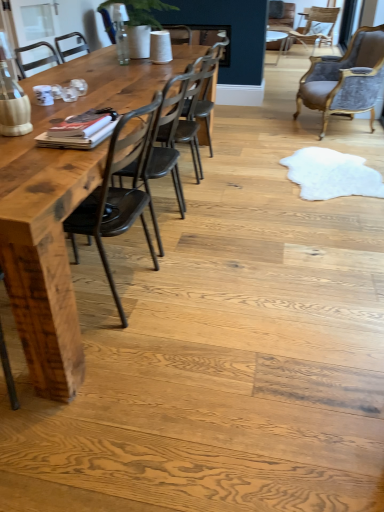
What is the approximate width of dark brown wood chair at center, which is the fourth chair from top to bottom?

dark brown wood chair at center, which is the fourth chair from top to bottom, is 22.74 inches wide.

Describe the element at coordinates (61, 210) in the screenshot. The height and width of the screenshot is (512, 384). I see `wooden table at left` at that location.

This screenshot has height=512, width=384. In order to click on velvet grey chair at upper right, which ranks as the 3th chair in left-to-right order in this screenshot , I will do `click(345, 78)`.

Locate an element on the screen. The image size is (384, 512). dark brown wood chair at center, the 4th chair from the right is located at coordinates (162, 148).

Does wooden table at left have a lesser width compared to velvet upholstered chair at upper right, the 4th chair ordered from the bottom?

No.

Can you tell me how much wooden table at left and velvet upholstered chair at upper right, which is counted as the 4th chair, starting from the front, differ in facing direction?

33 degrees.

In terms of size, does wooden table at left appear bigger or smaller than velvet upholstered chair at upper right, the 4th chair when ordered from left to right?

wooden table at left is bigger than velvet upholstered chair at upper right, the 4th chair when ordered from left to right.

Could you tell me if wooden table at left is turned towards velvet upholstered chair at upper right, the 4th chair ordered from the bottom?

No, wooden table at left is not aimed at velvet upholstered chair at upper right, the 4th chair ordered from the bottom.

Is velvet grey chair at upper right, placed as the second chair when sorted from right to left, located outside dark brown wood chair at center, placed as the first chair when sorted from bottom to top?

velvet grey chair at upper right, placed as the second chair when sorted from right to left, lies outside dark brown wood chair at center, placed as the first chair when sorted from bottom to top,'s area.

Is point (342, 106) closer or farther from the camera than point (142, 170)?

Point (342, 106) is farther from the camera than point (142, 170).

From the picture: From a real-world perspective, who is located higher, velvet grey chair at upper right, which ranks as the 3th chair in left-to-right order, or dark brown wood chair at center, the first chair when ordered from front to back?

In real-world perspective, velvet grey chair at upper right, which ranks as the 3th chair in left-to-right order, is above.

Is velvet grey chair at upper right, the third chair when ordered from front to back, in front of dark brown wood chair at center, the 4th chair from the back?

No, velvet grey chair at upper right, the third chair when ordered from front to back, is further to the viewer.

Find the location of a particular element. This screenshot has height=512, width=384. the 3rd chair behind when counting from the dark brown wood chair at center, placed as the first chair when sorted from bottom to top is located at coordinates (316, 26).

Which is in front, point (309, 41) or point (134, 168)?

The point (134, 168) is closer to the camera.

Is velvet upholstered chair at upper right, which is the 1th chair in right-to-left order, next to dark brown wood chair at center, the first chair when ordered from front to back, and touching it?

No, velvet upholstered chair at upper right, which is the 1th chair in right-to-left order, is not making contact with dark brown wood chair at center, the first chair when ordered from front to back.

Is velvet upholstered chair at upper right, which is counted as the 4th chair, starting from the front, facing away from dark brown wood chair at center, which is the fourth chair from top to bottom?

velvet upholstered chair at upper right, which is counted as the 4th chair, starting from the front, does not have its back to dark brown wood chair at center, which is the fourth chair from top to bottom.

Where is `chair below the wooden table at left (from the image's perspective)`? The height and width of the screenshot is (512, 384). chair below the wooden table at left (from the image's perspective) is located at coordinates point(162,148).

Considering the points (42, 247) and (179, 197), which point is behind, point (42, 247) or point (179, 197)?

Point (179, 197)

From a real-world perspective, does wooden table at left sit lower than dark brown wood chair at center, the 4th chair from the back?

Yes, from a real-world perspective, wooden table at left is under dark brown wood chair at center, the 4th chair from the back.

Are wooden table at left and dark brown wood chair at center, acting as the 1th chair starting from the left, far apart?

That's not correct — wooden table at left is a little close to dark brown wood chair at center, acting as the 1th chair starting from the left.

Is dark brown wood chair at center, acting as the 1th chair starting from the left, taller or shorter than velvet upholstered chair at upper right, which is counted as the 1th chair, starting from the back?

dark brown wood chair at center, acting as the 1th chair starting from the left, is taller than velvet upholstered chair at upper right, which is counted as the 1th chair, starting from the back.

Does dark brown wood chair at center, the 4th chair from the right, have a larger size compared to velvet upholstered chair at upper right, which appears as the 1th chair when viewed from the top?

Incorrect, dark brown wood chair at center, the 4th chair from the right, is not larger than velvet upholstered chair at upper right, which appears as the 1th chair when viewed from the top.

Locate an element on the screen. The height and width of the screenshot is (512, 384). the 3rd chair counting from the right of the dark brown wood chair at center, the first chair when ordered from front to back is located at coordinates (316, 26).

Which object is thinner, dark brown wood chair at center, the 4th chair from the back, or velvet upholstered chair at upper right, which is the 1th chair in right-to-left order?

Thinner between the two is dark brown wood chair at center, the 4th chair from the back.

Between dark brown wood chair at center, the first chair when ordered from front to back, and wooden table at left, which one has more height?

dark brown wood chair at center, the first chair when ordered from front to back, is taller.

Can you confirm if dark brown wood chair at center, which is the fourth chair from top to bottom, is wider than wooden table at left?

In fact, dark brown wood chair at center, which is the fourth chair from top to bottom, might be narrower than wooden table at left.

From the image's perspective, is dark brown wood chair at center, placed as the first chair when sorted from bottom to top, on wooden table at left?

Actually, dark brown wood chair at center, placed as the first chair when sorted from bottom to top, appears below wooden table at left in the image.

Is wooden table at left completely or partially inside dark brown wood chair at center, the 4th chair from the right?

No, wooden table at left is located outside of dark brown wood chair at center, the 4th chair from the right.

Looking at this image, between velvet grey chair at upper right, which ranks as the 3th chair in left-to-right order, and velvet upholstered chair at upper right, which is counted as the 1th chair, starting from the back, which one has smaller size?

velvet upholstered chair at upper right, which is counted as the 1th chair, starting from the back.

Is velvet upholstered chair at upper right, which is counted as the 4th chair, starting from the front, at the back of velvet grey chair at upper right, placed as the second chair when sorted from right to left?

No.

Which of these two, velvet grey chair at upper right, the 2th chair in the top-to-bottom sequence, or velvet upholstered chair at upper right, which appears as the 1th chair when viewed from the top, stands taller?

velvet grey chair at upper right, the 2th chair in the top-to-bottom sequence.

You are a GUI agent. You are given a task and a screenshot of the screen. Output one action in this format:
    pyautogui.click(x=<x>, y=<y>)
    Task: Click on the 3rd chair above when counting from the wooden table at left (from the image's perspective)
    Image resolution: width=384 pixels, height=512 pixels.
    Given the screenshot: What is the action you would take?
    pyautogui.click(x=316, y=26)

At what (x,y) coordinates should I click in order to perform the action: click on chair that is the 2nd object to the left of the velvet grey chair at upper right, which ranks as the 3th chair in left-to-right order, starting at the anchor. Please return your answer as a coordinate pair (x, y). The width and height of the screenshot is (384, 512). Looking at the image, I should click on [162, 148].

When comparing their distances from metallic dark brown chair at center, the second chair viewed from the left, does dark brown wood chair at center, which is the fourth chair from top to bottom, or velvet grey chair at upper right, the third chair when ordered from front to back, seem further?

The object further to metallic dark brown chair at center, the second chair viewed from the left, is velvet grey chair at upper right, the third chair when ordered from front to back.

Based on their spatial positions, is metallic dark brown chair at center, which is the 2th chair from front to back, or dark brown wood chair at center, placed as the first chair when sorted from bottom to top, closer to wooden table at left?

dark brown wood chair at center, placed as the first chair when sorted from bottom to top, is positioned closer to the anchor wooden table at left.

Considering their positions, is metallic dark brown chair at center, placed as the third chair when sorted from right to left, positioned further to wooden table at left than velvet upholstered chair at upper right, the 4th chair ordered from the bottom?

velvet upholstered chair at upper right, the 4th chair ordered from the bottom.

Considering their positions, is dark brown wood chair at center, the first chair when ordered from front to back, positioned closer to wooden table at left than metallic dark brown chair at center, the third chair in the top-to-bottom sequence?

Among the two, dark brown wood chair at center, the first chair when ordered from front to back, is located nearer to wooden table at left.

Estimate the real-world distances between objects in this image. Which object is further from velvet grey chair at upper right, which ranks as the 3th chair in left-to-right order, velvet upholstered chair at upper right, which appears as the 1th chair when viewed from the top, or wooden table at left?

velvet upholstered chair at upper right, which appears as the 1th chair when viewed from the top.

Based on their spatial positions, is wooden table at left or velvet upholstered chair at upper right, the 4th chair when ordered from left to right, further from metallic dark brown chair at center, which is the third chair in back-to-front order?

Among the two, velvet upholstered chair at upper right, the 4th chair when ordered from left to right, is located further to metallic dark brown chair at center, which is the third chair in back-to-front order.

From the image, which object appears to be nearer to wooden table at left, velvet grey chair at upper right, the 2th chair in the top-to-bottom sequence, or dark brown wood chair at center, the 4th chair from the back?

Based on the image, dark brown wood chair at center, the 4th chair from the back, appears to be nearer to wooden table at left.

Considering their positions, is dark brown wood chair at center, placed as the first chair when sorted from bottom to top, positioned closer to metallic dark brown chair at center, which is the second chair in bottom-to-top order, than wooden table at left?

The object closer to metallic dark brown chair at center, which is the second chair in bottom-to-top order, is dark brown wood chair at center, placed as the first chair when sorted from bottom to top.

You are a GUI agent. You are given a task and a screenshot of the screen. Output one action in this format:
    pyautogui.click(x=<x>, y=<y>)
    Task: Click on the chair located between wooden table at left and metallic dark brown chair at center, which is the second chair in bottom-to-top order, in the depth direction
    Image resolution: width=384 pixels, height=512 pixels.
    Given the screenshot: What is the action you would take?
    pyautogui.click(x=162, y=148)

Locate an element on the screen. The width and height of the screenshot is (384, 512). chair between metallic dark brown chair at center, placed as the third chair when sorted from right to left, and velvet upholstered chair at upper right, the 4th chair ordered from the bottom, along the z-axis is located at coordinates (345, 78).

Locate an element on the screen. This screenshot has width=384, height=512. chair between dark brown wood chair at center, which is the fourth chair from top to bottom, and velvet grey chair at upper right, the 2th chair in the top-to-bottom sequence, in the horizontal direction is located at coordinates (192, 114).